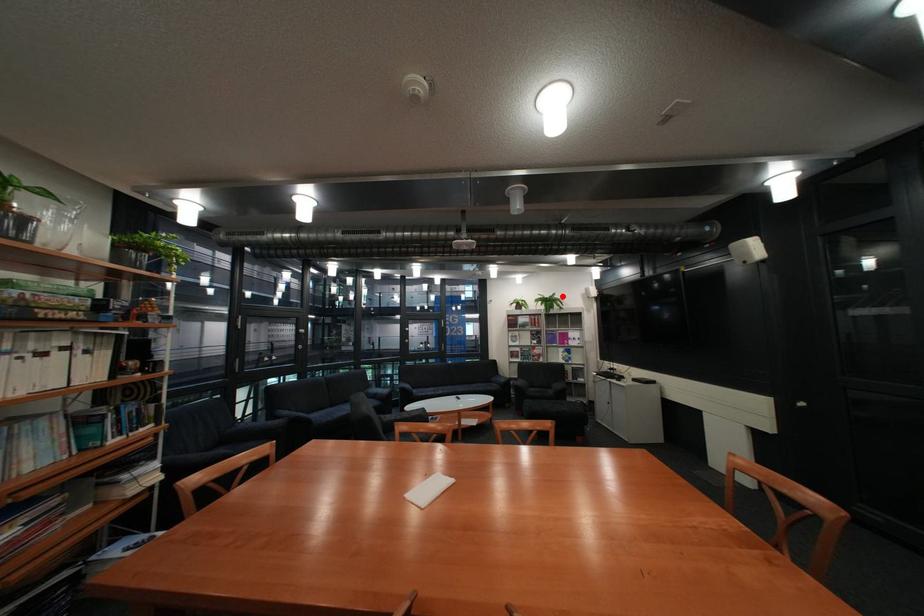
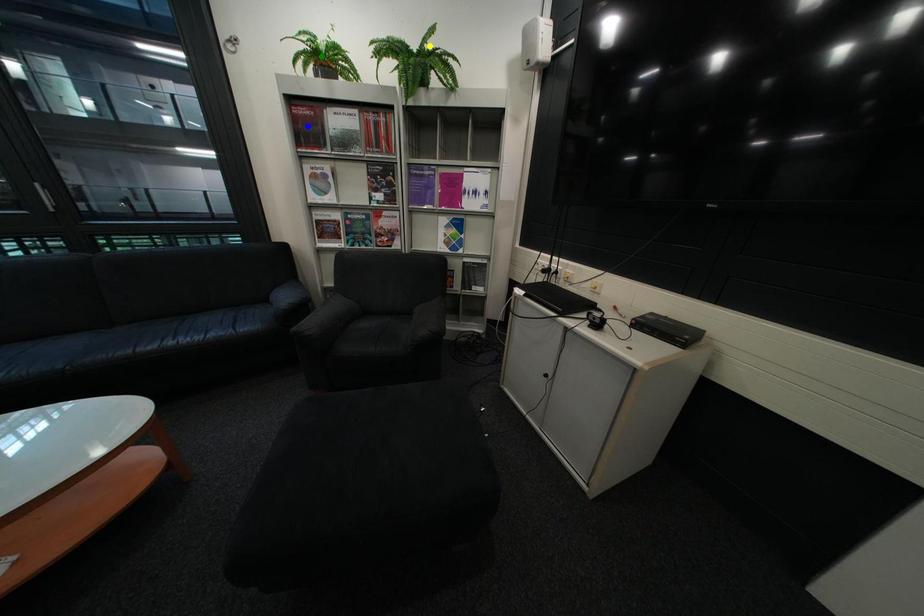
Question: I am providing you with two images of the same scene from different viewpoints. A red point is marked on the first image. You are given multiple points on the second image. Which point in image 2 represents the same 3d spot as the red point in image 1?

Choices:
 (A) green point
 (B) yellow point
 (C) blue point

Answer: (B)